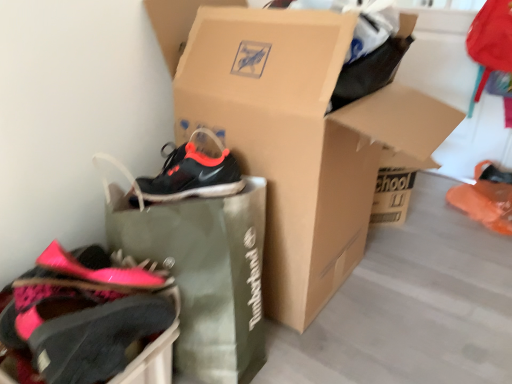
Describe the element at coordinates (202, 270) in the screenshot. I see `green fabric shopping bag at center` at that location.

What are the coordinates of `pink fabric shoe at lower left, which ranks as the first footwear in left-to-right order` in the screenshot? It's located at (81, 314).

The height and width of the screenshot is (384, 512). I want to click on green fabric shopping bag at center, so click(202, 270).

Which object is more forward, orange matte shoe at lower right, which is the 1th footwear from back to front, or pink fabric shoe at lower left, placed as the 2th footwear when sorted from right to left?

pink fabric shoe at lower left, placed as the 2th footwear when sorted from right to left, is closer to the camera.

Considering the sizes of objects orange matte shoe at lower right, positioned as the 2th footwear in front-to-back order, and pink fabric shoe at lower left, placed as the 2th footwear when sorted from right to left, in the image provided, who is bigger, orange matte shoe at lower right, positioned as the 2th footwear in front-to-back order, or pink fabric shoe at lower left, placed as the 2th footwear when sorted from right to left,?

With larger size is pink fabric shoe at lower left, placed as the 2th footwear when sorted from right to left.

Would you consider orange matte shoe at lower right, which is the 1th footwear from back to front, to be distant from pink fabric shoe at lower left, the 2th footwear viewed from the back?

Absolutely, orange matte shoe at lower right, which is the 1th footwear from back to front, is distant from pink fabric shoe at lower left, the 2th footwear viewed from the back.

From the image's perspective, is orange matte shoe at lower right, marked as the second footwear in a left-to-right arrangement, above or below pink fabric shoe at lower left, which ranks as the first footwear in left-to-right order?

orange matte shoe at lower right, marked as the second footwear in a left-to-right arrangement, is situated higher than pink fabric shoe at lower left, which ranks as the first footwear in left-to-right order, in the image.

From a real-world perspective, is green fabric shopping bag at center beneath cardboard shoebox at center?

Yes.

Considering the relative sizes of green fabric shopping bag at center and cardboard shoebox at center in the image provided, is green fabric shopping bag at center bigger than cardboard shoebox at center?

Incorrect, green fabric shopping bag at center is not larger than cardboard shoebox at center.

Is green fabric shopping bag at center not near cardboard shoebox at center?

They are positioned close to each other.

From the picture: From the image's perspective, is cardboard shoebox at center under pink fabric shoe at lower left, which ranks as the first footwear in left-to-right order?

Actually, cardboard shoebox at center appears above pink fabric shoe at lower left, which ranks as the first footwear in left-to-right order, in the image.

From a real-world perspective, between cardboard shoebox at center and pink fabric shoe at lower left, which is the first footwear from front to back, who is vertically lower?

pink fabric shoe at lower left, which is the first footwear from front to back, is physically lower.

Which is more to the right, cardboard shoebox at center or pink fabric shoe at lower left, which ranks as the first footwear in left-to-right order?

Positioned to the right is cardboard shoebox at center.

Does point (231, 34) come behind point (135, 328)?

Yes, point (231, 34) is farther from viewer.

Is cardboard shoebox at center bigger or smaller than orange matte shoe at lower right, marked as the second footwear in a left-to-right arrangement?

Considering their sizes, cardboard shoebox at center takes up more space than orange matte shoe at lower right, marked as the second footwear in a left-to-right arrangement.

How distant is cardboard shoebox at center from orange matte shoe at lower right, the first footwear viewed from the right?

cardboard shoebox at center and orange matte shoe at lower right, the first footwear viewed from the right, are 37.14 inches apart.

From the image's perspective, is cardboard shoebox at center on orange matte shoe at lower right, the first footwear viewed from the right?

Yes, from the image's perspective, cardboard shoebox at center is over orange matte shoe at lower right, the first footwear viewed from the right.

Are cardboard shoebox at center and orange matte shoe at lower right, the first footwear viewed from the right, making contact?

No, cardboard shoebox at center is not beside orange matte shoe at lower right, the first footwear viewed from the right.

Which object is further away from the camera taking this photo, pink fabric shoe at lower left, the 2th footwear viewed from the back, or orange matte shoe at lower right, which is the 1th footwear from back to front?

orange matte shoe at lower right, which is the 1th footwear from back to front, is further from the camera.

Considering the positions of point (69, 326) and point (473, 212), is point (69, 326) closer or farther from the camera than point (473, 212)?

Point (69, 326) is positioned closer to the camera compared to point (473, 212).

From the image's perspective, is pink fabric shoe at lower left, which is the first footwear from front to back, located above or below orange matte shoe at lower right, the first footwear viewed from the right?

pink fabric shoe at lower left, which is the first footwear from front to back, is below orange matte shoe at lower right, the first footwear viewed from the right.

Choose the correct answer: Is pink fabric shoe at lower left, which ranks as the first footwear in left-to-right order, inside orange matte shoe at lower right, positioned as the 2th footwear in front-to-back order, or outside it?

pink fabric shoe at lower left, which ranks as the first footwear in left-to-right order, is not enclosed by orange matte shoe at lower right, positioned as the 2th footwear in front-to-back order.

Image resolution: width=512 pixels, height=384 pixels. Find the location of `box lying in front of the orange matte shoe at lower right, the first footwear viewed from the right`. box lying in front of the orange matte shoe at lower right, the first footwear viewed from the right is located at coordinates (295, 132).

Can cardboard shoebox at center be found inside orange matte shoe at lower right, which is the 1th footwear from back to front?

No, cardboard shoebox at center is not a part of orange matte shoe at lower right, which is the 1th footwear from back to front.

Considering the positions of objects orange matte shoe at lower right, which is the 1th footwear from back to front, and cardboard shoebox at center in the image provided, who is more to the left, orange matte shoe at lower right, which is the 1th footwear from back to front, or cardboard shoebox at center?

cardboard shoebox at center.

From the image's perspective, between orange matte shoe at lower right, positioned as the 2th footwear in front-to-back order, and cardboard shoebox at center, who is located below?

orange matte shoe at lower right, positioned as the 2th footwear in front-to-back order.

Does orange matte shoe at lower right, which is the 1th footwear from back to front, have a greater height compared to green fabric shopping bag at center?

No.

Are orange matte shoe at lower right, which is the 1th footwear from back to front, and green fabric shopping bag at center making contact?

No, orange matte shoe at lower right, which is the 1th footwear from back to front, is not beside green fabric shopping bag at center.

Between orange matte shoe at lower right, positioned as the 2th footwear in front-to-back order, and green fabric shopping bag at center, which one has larger size?

green fabric shopping bag at center is bigger.

From the image's perspective, is orange matte shoe at lower right, positioned as the 2th footwear in front-to-back order, below green fabric shopping bag at center?

No.

Find the location of a particular element. Image resolution: width=512 pixels, height=384 pixels. footwear above the orange matte shoe at lower right, marked as the second footwear in a left-to-right arrangement (from a real-world perspective) is located at coordinates (81, 314).

The image size is (512, 384). I want to click on shopping bag directly beneath the cardboard shoebox at center (from a real-world perspective), so click(x=202, y=270).

Which object lies further to the anchor point pink fabric shoe at lower left, placed as the 2th footwear when sorted from right to left, orange matte shoe at lower right, which is the 1th footwear from back to front, or cardboard shoebox at center?

orange matte shoe at lower right, which is the 1th footwear from back to front, lies further to pink fabric shoe at lower left, placed as the 2th footwear when sorted from right to left, than the other object.

From the image, which object appears to be farther from cardboard shoebox at center, green fabric shopping bag at center or pink fabric shoe at lower left, placed as the 2th footwear when sorted from right to left?

pink fabric shoe at lower left, placed as the 2th footwear when sorted from right to left, is positioned further to the anchor cardboard shoebox at center.

Which object lies nearer to the anchor point cardboard shoebox at center, pink fabric shoe at lower left, which ranks as the first footwear in left-to-right order, or orange matte shoe at lower right, the first footwear viewed from the right?

pink fabric shoe at lower left, which ranks as the first footwear in left-to-right order, is closer to cardboard shoebox at center.

Estimate the real-world distances between objects in this image. Which object is closer to cardboard shoebox at center, orange matte shoe at lower right, marked as the second footwear in a left-to-right arrangement, or green fabric shopping bag at center?

green fabric shopping bag at center is closer to cardboard shoebox at center.

From the picture: When comparing their distances from cardboard shoebox at center, does green fabric shopping bag at center or orange matte shoe at lower right, the first footwear viewed from the right, seem closer?

green fabric shopping bag at center lies closer to cardboard shoebox at center than the other object.

Based on their spatial positions, is green fabric shopping bag at center or pink fabric shoe at lower left, placed as the 2th footwear when sorted from right to left, further from orange matte shoe at lower right, marked as the second footwear in a left-to-right arrangement?

Based on the image, pink fabric shoe at lower left, placed as the 2th footwear when sorted from right to left, appears to be further to orange matte shoe at lower right, marked as the second footwear in a left-to-right arrangement.

When comparing their distances from pink fabric shoe at lower left, which ranks as the first footwear in left-to-right order, does orange matte shoe at lower right, marked as the second footwear in a left-to-right arrangement, or green fabric shopping bag at center seem closer?

The object closer to pink fabric shoe at lower left, which ranks as the first footwear in left-to-right order, is green fabric shopping bag at center.

Based on their spatial positions, is cardboard shoebox at center or orange matte shoe at lower right, the first footwear viewed from the right, further from pink fabric shoe at lower left, which ranks as the first footwear in left-to-right order?

orange matte shoe at lower right, the first footwear viewed from the right.

You are a GUI agent. You are given a task and a screenshot of the screen. Output one action in this format:
    pyautogui.click(x=<x>, y=<y>)
    Task: Click on the shopping bag situated between pink fabric shoe at lower left, which ranks as the first footwear in left-to-right order, and cardboard shoebox at center from left to right
    The height and width of the screenshot is (384, 512).
    Given the screenshot: What is the action you would take?
    pyautogui.click(x=202, y=270)

This screenshot has width=512, height=384. In order to click on shopping bag between pink fabric shoe at lower left, placed as the 2th footwear when sorted from right to left, and orange matte shoe at lower right, marked as the second footwear in a left-to-right arrangement, from left to right in this screenshot , I will do `click(202, 270)`.

Find the location of a particular element. box between green fabric shopping bag at center and orange matte shoe at lower right, marked as the second footwear in a left-to-right arrangement, from left to right is located at coordinates (295, 132).

Where is `box between pink fabric shoe at lower left, which ranks as the first footwear in left-to-right order, and orange matte shoe at lower right, which is the 1th footwear from back to front`? Image resolution: width=512 pixels, height=384 pixels. box between pink fabric shoe at lower left, which ranks as the first footwear in left-to-right order, and orange matte shoe at lower right, which is the 1th footwear from back to front is located at coordinates (295, 132).